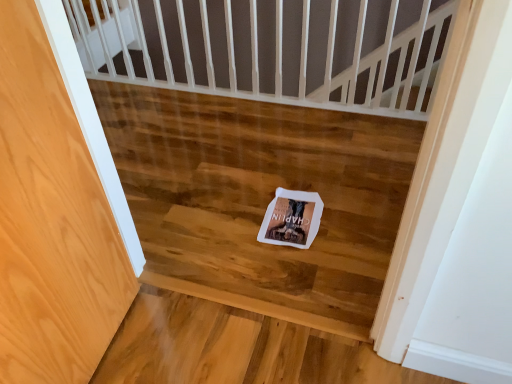
Question: Is wooden floor at center placed right next to white paper postcard at center?

Choices:
 (A) yes
 (B) no

Answer: (B)

Question: Could you tell me if wooden floor at center is facing white paper postcard at center?

Choices:
 (A) no
 (B) yes

Answer: (B)

Question: Is wooden floor at center thinner than white paper postcard at center?

Choices:
 (A) no
 (B) yes

Answer: (A)

Question: Considering the relative positions of wooden floor at center and white paper postcard at center in the image provided, is wooden floor at center behind white paper postcard at center?

Choices:
 (A) no
 (B) yes

Answer: (A)

Question: Is wooden floor at center to the left of white paper postcard at center from the viewer's perspective?

Choices:
 (A) yes
 (B) no

Answer: (A)

Question: From the image's perspective, is wooden floor at center located above white paper postcard at center?

Choices:
 (A) yes
 (B) no

Answer: (A)

Question: From the image's perspective, does white paper postcard at center appear lower than wooden floor at center?

Choices:
 (A) yes
 (B) no

Answer: (A)

Question: From a real-world perspective, is white paper postcard at center physically below wooden floor at center?

Choices:
 (A) no
 (B) yes

Answer: (B)

Question: Does white paper postcard at center have a lesser width compared to wooden floor at center?

Choices:
 (A) no
 (B) yes

Answer: (B)

Question: Is white paper postcard at center to the right of wooden floor at center from the viewer's perspective?

Choices:
 (A) no
 (B) yes

Answer: (B)

Question: Could wooden floor at center be considered to be inside white paper postcard at center?

Choices:
 (A) yes
 (B) no

Answer: (B)

Question: Can you confirm if white paper postcard at center is taller than wooden floor at center?

Choices:
 (A) no
 (B) yes

Answer: (A)

Question: Is white paper postcard at center taller or shorter than wooden floor at center?

Choices:
 (A) tall
 (B) short

Answer: (B)